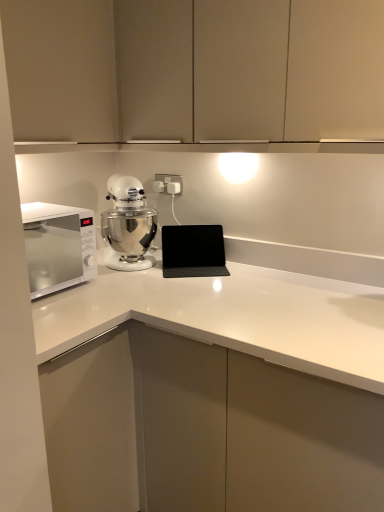
The width and height of the screenshot is (384, 512). What do you see at coordinates (58, 246) in the screenshot? I see `white glossy microwave at left` at bounding box center [58, 246].

Find the location of a particular element. The image size is (384, 512). white plastic electric outlet at center is located at coordinates (168, 184).

What do you see at coordinates (61, 69) in the screenshot? I see `matte beige cabinet at upper left, which is counted as the first cabinetry, starting from the left` at bounding box center [61, 69].

From the picture: What is the approximate width of matte beige cabinet at upper left, acting as the 2th cabinetry starting from the right?

matte beige cabinet at upper left, acting as the 2th cabinetry starting from the right, is 32.32 centimeters wide.

The width and height of the screenshot is (384, 512). I want to click on white glossy microwave at left, so point(58,246).

Is there a large distance between white glossy countertop at center and matte beige cabinet at upper left, acting as the 2th cabinetry starting from the right?

No.

Is white glossy countertop at center oriented towards matte beige cabinet at upper left, which is counted as the first cabinetry, starting from the left?

No, white glossy countertop at center is not oriented towards matte beige cabinet at upper left, which is counted as the first cabinetry, starting from the left.

How far apart are white glossy countertop at center and matte beige cabinet at upper left, acting as the 2th cabinetry starting from the right?

A distance of 32.32 inches exists between white glossy countertop at center and matte beige cabinet at upper left, acting as the 2th cabinetry starting from the right.

Which object is further away from the camera taking this photo, white glossy countertop at center or matte beige cabinet at upper left, which is counted as the first cabinetry, starting from the left?

matte beige cabinet at upper left, which is counted as the first cabinetry, starting from the left, is more distant.

Does point (220, 241) appear closer or farther from the camera than point (133, 209)?

Point (220, 241) is farther from the camera than point (133, 209).

Which is more to the left, black matte laptop at center or silver metallic mixer at center?

From the viewer's perspective, silver metallic mixer at center appears more on the left side.

Where is `mixer that appears on the left of black matte laptop at center`? The image size is (384, 512). mixer that appears on the left of black matte laptop at center is located at coordinates (128, 225).

Relative to silver metallic mixer at center, is black matte laptop at center in front or behind?

Visually, black matte laptop at center is located behind silver metallic mixer at center.

Could you tell me if black matte laptop at center is facing matte beige cabinet at upper left, acting as the 2th cabinetry starting from the right?

No, black matte laptop at center is not turned towards matte beige cabinet at upper left, acting as the 2th cabinetry starting from the right.

Considering the sizes of objects black matte laptop at center and matte beige cabinet at upper left, acting as the 2th cabinetry starting from the right, in the image provided, who is bigger, black matte laptop at center or matte beige cabinet at upper left, acting as the 2th cabinetry starting from the right,?

With larger size is matte beige cabinet at upper left, acting as the 2th cabinetry starting from the right.

From the image's perspective, which one is positioned lower, black matte laptop at center or matte beige cabinet at upper left, which is counted as the first cabinetry, starting from the left?

black matte laptop at center.

Considering the relative sizes of black matte laptop at center and matte beige cabinet at upper left, acting as the 2th cabinetry starting from the right, in the image provided, is black matte laptop at center taller than matte beige cabinet at upper left, acting as the 2th cabinetry starting from the right,?

In fact, black matte laptop at center may be shorter than matte beige cabinet at upper left, acting as the 2th cabinetry starting from the right.

Which object is further away from the camera, matte beige cabinet at upper left, which is counted as the first cabinetry, starting from the left, or silver metallic mixer at center?

Positioned behind is silver metallic mixer at center.

From a real-world perspective, is matte beige cabinet at upper left, which is counted as the first cabinetry, starting from the left, above or below silver metallic mixer at center?

From a real-world perspective, matte beige cabinet at upper left, which is counted as the first cabinetry, starting from the left, is physically above silver metallic mixer at center.

Could you tell me if matte beige cabinet at upper left, acting as the 2th cabinetry starting from the right, is turned towards silver metallic mixer at center?

No, matte beige cabinet at upper left, acting as the 2th cabinetry starting from the right, is not aimed at silver metallic mixer at center.

From the image's perspective, between black matte laptop at center and white glossy microwave at left, which one is located above?

From the image's view, white glossy microwave at left is above.

Considering the relative positions of black matte laptop at center and white glossy microwave at left in the image provided, is black matte laptop at center to the right of white glossy microwave at left from the viewer's perspective?

Correct, you'll find black matte laptop at center to the right of white glossy microwave at left.

From a real-world perspective, is black matte laptop at center positioned over white glossy microwave at left based on gravity?

Actually, black matte laptop at center is physically below white glossy microwave at left in the real world.

Can white glossy microwave at left be found inside black matte laptop at center?

Definitely not — white glossy microwave at left is not inside black matte laptop at center.

Does point (167, 193) come in front of point (126, 193)?

That is False.

From the image's perspective, is white plastic electric outlet at center on top of silver metallic mixer at center?

Indeed, from the image's perspective, white plastic electric outlet at center is shown above silver metallic mixer at center.

How many degrees apart are the facing directions of white plastic electric outlet at center and silver metallic mixer at center?

54.8 degrees separate the facing orientations of white plastic electric outlet at center and silver metallic mixer at center.

Is white plastic electric outlet at center next to silver metallic mixer at center and touching it?

white plastic electric outlet at center is not next to silver metallic mixer at center, and they're not touching.

From a real-world perspective, does black matte laptop at center stand above matte beige cabinets at upper center, arranged as the second cabinetry when viewed from the left?

No, from a real-world perspective, black matte laptop at center is not over matte beige cabinets at upper center, arranged as the second cabinetry when viewed from the left

Which of these two, black matte laptop at center or matte beige cabinets at upper center, the 1th cabinetry positioned from the right, is smaller?

With smaller size is black matte laptop at center.

Can you see black matte laptop at center touching matte beige cabinets at upper center, the 1th cabinetry positioned from the right?

black matte laptop at center is not next to matte beige cabinets at upper center, the 1th cabinetry positioned from the right, and they're not touching.

What are the coordinates of `countertop that is under the matte beige cabinet at upper left, acting as the 2th cabinetry starting from the right (from a real-world perspective)` in the screenshot? It's located at (213, 392).

Where is `mixer that is on the left side of black matte laptop at center`? mixer that is on the left side of black matte laptop at center is located at coordinates (128, 225).

From the image, which object appears to be nearer to matte beige cabinet at upper left, acting as the 2th cabinetry starting from the right, white glossy countertop at center or white glossy microwave at left?

Among the two, white glossy microwave at left is located nearer to matte beige cabinet at upper left, acting as the 2th cabinetry starting from the right.

When comparing their distances from black matte laptop at center, does white glossy countertop at center or matte beige cabinet at upper left, acting as the 2th cabinetry starting from the right, seem further?

matte beige cabinet at upper left, acting as the 2th cabinetry starting from the right, lies further to black matte laptop at center than the other object.

From the image, which object appears to be farther from white glossy microwave at left, white glossy countertop at center or matte beige cabinets at upper center, the 1th cabinetry positioned from the right?

Among the two, matte beige cabinets at upper center, the 1th cabinetry positioned from the right, is located further to white glossy microwave at left.

Based on their spatial positions, is matte beige cabinets at upper center, arranged as the second cabinetry when viewed from the left, or black matte laptop at center further from matte beige cabinet at upper left, which is counted as the first cabinetry, starting from the left?

black matte laptop at center lies further to matte beige cabinet at upper left, which is counted as the first cabinetry, starting from the left, than the other object.

Estimate the real-world distances between objects in this image. Which object is further from white plastic electric outlet at center, matte beige cabinet at upper left, which is counted as the first cabinetry, starting from the left, or white glossy microwave at left?

matte beige cabinet at upper left, which is counted as the first cabinetry, starting from the left.

Considering their positions, is white plastic electric outlet at center positioned closer to silver metallic mixer at center than black matte laptop at center?

Among the two, black matte laptop at center is located nearer to silver metallic mixer at center.

Estimate the real-world distances between objects in this image. Which object is closer to white glossy microwave at left, matte beige cabinets at upper center, arranged as the second cabinetry when viewed from the left, or white glossy countertop at center?

white glossy countertop at center is closer to white glossy microwave at left.

Estimate the real-world distances between objects in this image. Which object is further from matte beige cabinet at upper left, which is counted as the first cabinetry, starting from the left, matte beige cabinets at upper center, the 1th cabinetry positioned from the right, or white glossy microwave at left?

white glossy microwave at left.

Image resolution: width=384 pixels, height=512 pixels. I want to click on cabinetry located between matte beige cabinets at upper center, the 1th cabinetry positioned from the right, and silver metallic mixer at center in the depth direction, so click(61, 69).

Identify the location of laptop between matte beige cabinet at upper left, acting as the 2th cabinetry starting from the right, and white glossy countertop at center from top to bottom. (193, 251).

Locate an element on the screen. This screenshot has width=384, height=512. home appliance between matte beige cabinet at upper left, acting as the 2th cabinetry starting from the right, and black matte laptop at center in the up-down direction is located at coordinates (58, 246).

Identify the location of laptop between white glossy countertop at center and white plastic electric outlet at center from front to back. point(193,251).